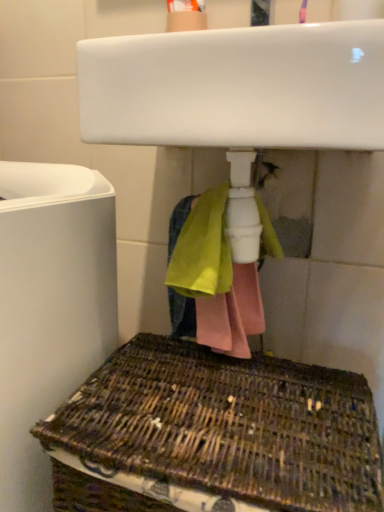
Question: Considering the relative positions of woven brown basket at lower center and white matte toilet at left in the image provided, is woven brown basket at lower center to the left of white matte toilet at left from the viewer's perspective?

Choices:
 (A) no
 (B) yes

Answer: (A)

Question: Are woven brown basket at lower center and white matte toilet at left making contact?

Choices:
 (A) yes
 (B) no

Answer: (B)

Question: From the image's perspective, does woven brown basket at lower center appear higher than white matte toilet at left?

Choices:
 (A) yes
 (B) no

Answer: (B)

Question: Considering the relative positions of woven brown basket at lower center and white matte toilet at left in the image provided, is woven brown basket at lower center behind white matte toilet at left?

Choices:
 (A) no
 (B) yes

Answer: (A)

Question: Is woven brown basket at lower center outside white matte toilet at left?

Choices:
 (A) yes
 (B) no

Answer: (A)

Question: In terms of size, does white glossy sink at upper center appear bigger or smaller than white matte toilet at left?

Choices:
 (A) big
 (B) small

Answer: (B)

Question: Is white glossy sink at upper center inside the boundaries of white matte toilet at left, or outside?

Choices:
 (A) inside
 (B) outside

Answer: (B)

Question: Relative to white matte toilet at left, is white glossy sink at upper center in front or behind?

Choices:
 (A) behind
 (B) front

Answer: (B)

Question: From the image's perspective, is white glossy sink at upper center above or below white matte toilet at left?

Choices:
 (A) below
 (B) above

Answer: (B)

Question: From a real-world perspective, is white glossy sink at upper center positioned above or below woven brown basket at lower center?

Choices:
 (A) above
 (B) below

Answer: (A)

Question: Do you think white glossy sink at upper center is within woven brown basket at lower center, or outside of it?

Choices:
 (A) inside
 (B) outside

Answer: (B)

Question: From the image's perspective, is white glossy sink at upper center above or below woven brown basket at lower center?

Choices:
 (A) above
 (B) below

Answer: (A)

Question: Is point (185, 46) positioned closer to the camera than point (120, 446)?

Choices:
 (A) farther
 (B) closer

Answer: (A)

Question: Is point (56, 467) positioned closer to the camera than point (377, 41)?

Choices:
 (A) closer
 (B) farther

Answer: (B)

Question: From their relative heights in the image, would you say woven brown basket at lower center is taller or shorter than white glossy sink at upper center?

Choices:
 (A) short
 (B) tall

Answer: (B)